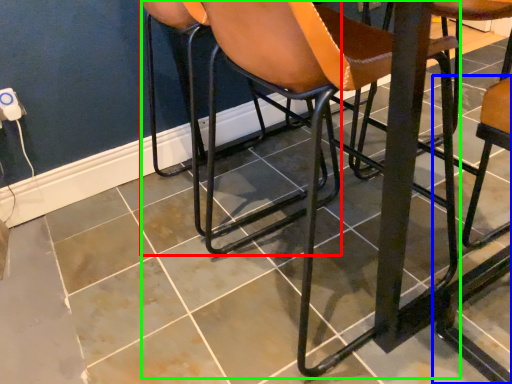
Question: Based on their relative distances, which object is nearer to chair (highlighted by a red box)? Choose from chair (highlighted by a blue box) and chair (highlighted by a green box).

Choices:
 (A) chair
 (B) chair

Answer: (B)